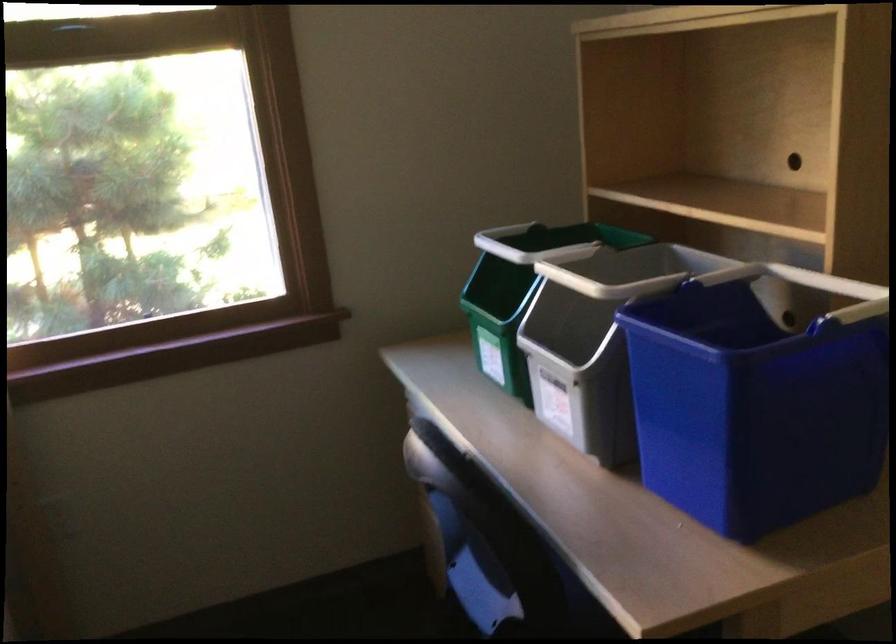
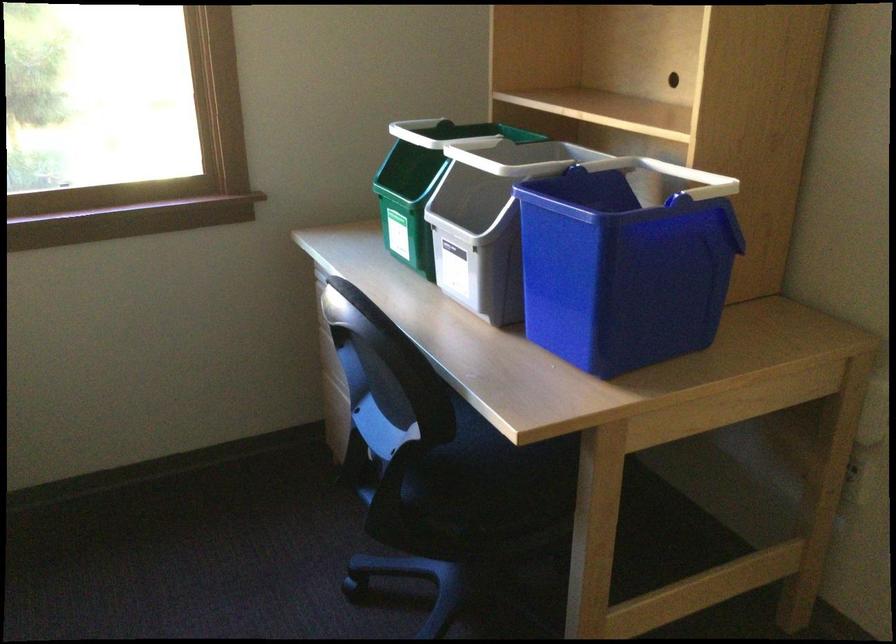
In the second image, find the point that corresponds to [515,294] in the first image.

(421, 184)